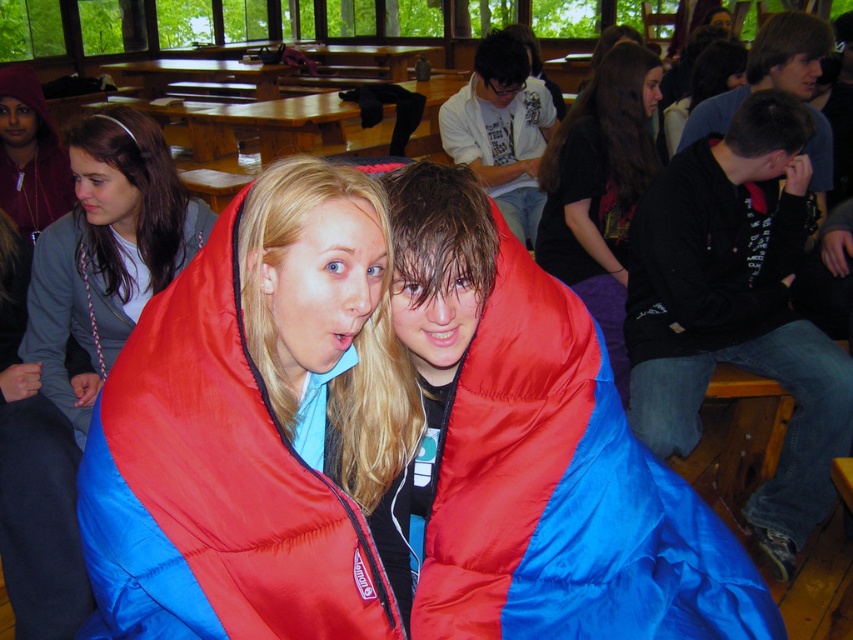
You are a photographer standing at the back of the room with a camera that has a 3.5 feet focal length. You want to capture both the red nylon sleeping bag at center and the matte blue sleeping bag at center in the same frame. Is this possible?

The distance between the red nylon sleeping bag at center and the matte blue sleeping bag at center is 4.63 feet. Since the camera has a focal length of 3.5 feet, which is shorter than the distance between them, the photographer may need to adjust their position or use a wider lens to include both in the frame.